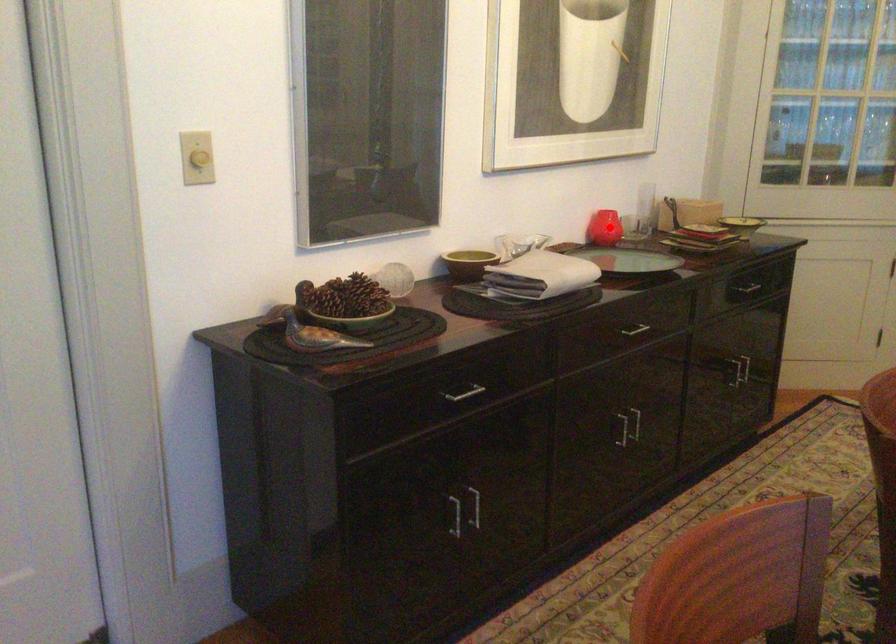
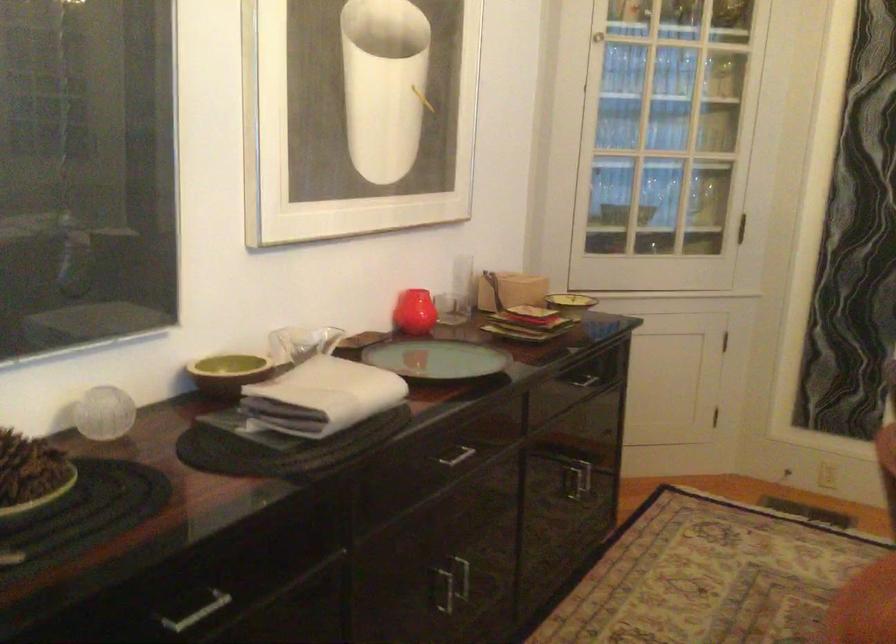
Where in the second image is the point corresponding to the highlighted location from the first image?

(414, 312)